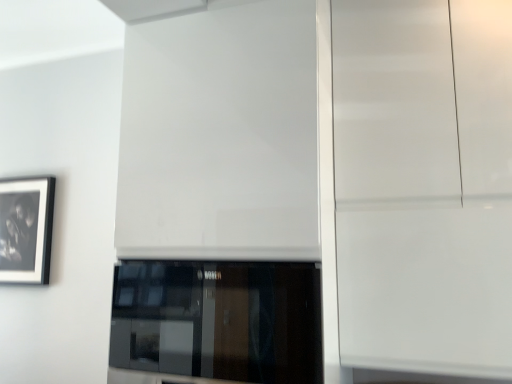
Question: Relative to black glass window at center, is glossy white cabinet at right in front or behind?

Choices:
 (A) behind
 (B) front

Answer: (A)

Question: From a real-world perspective, is glossy white cabinet at right above or below black glass window at center?

Choices:
 (A) above
 (B) below

Answer: (A)

Question: Which object is the closest to the white glossy door at center?

Choices:
 (A) black matte picture frame at left
 (B) glossy white cabinet at right
 (C) black glass window at center

Answer: (C)

Question: Considering the real-world distances, which object is farthest from the black matte picture frame at left?

Choices:
 (A) glossy white cabinet at right
 (B) black glass window at center
 (C) white glossy door at center

Answer: (A)